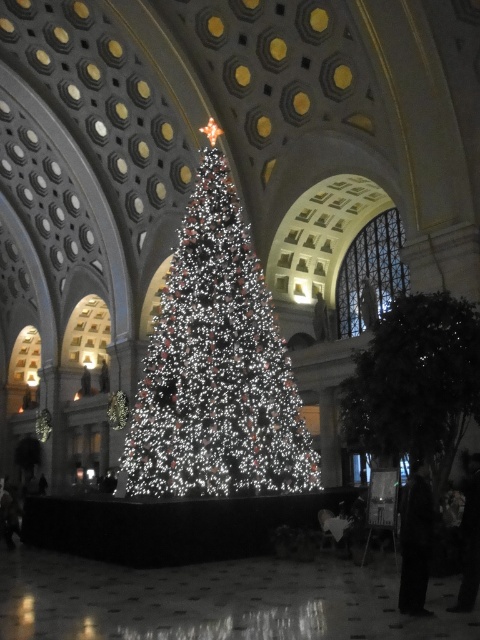
Which is in front, point (188, 266) or point (476, 316)?

Point (476, 316) is in front.

Is point (288, 376) closer to camera compared to point (408, 324)?

No, (288, 376) is behind (408, 324).

Find the location of a particular element. illuminated plastic christmas tree at center is located at coordinates (216, 365).